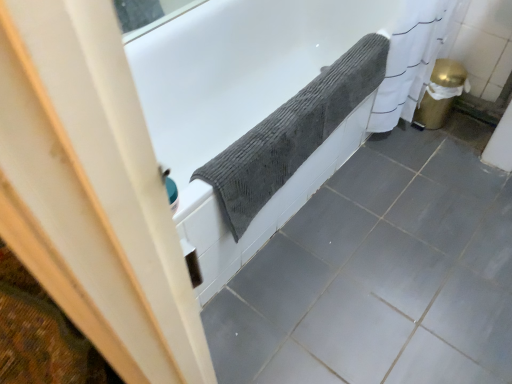
Identify the location of vacant space situated on the left part of gray matte ceramic tile at lower center, positioned as the 1th ceramic tile in top-to-bottom order. This screenshot has height=384, width=512. (442, 220).